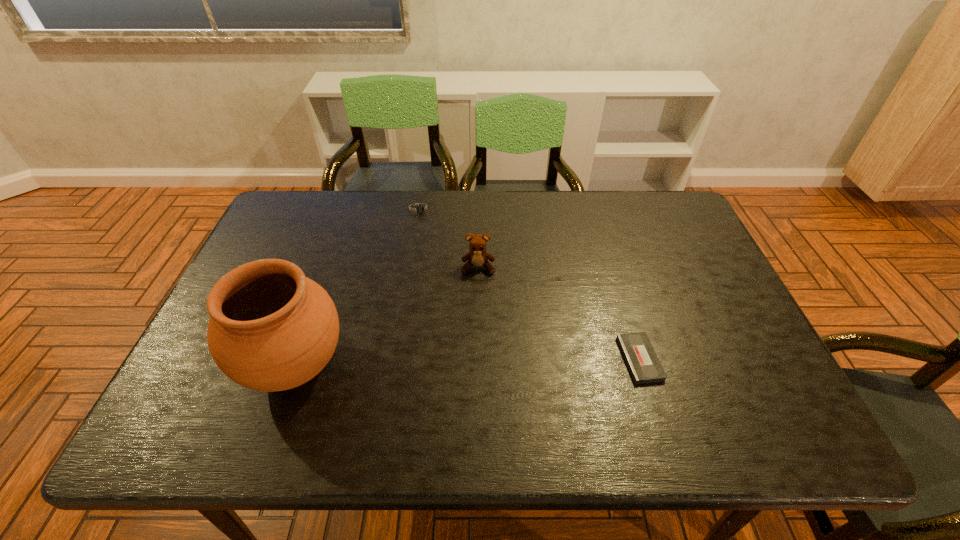
I want to click on vacant area that lies between the second object from right to left and the videotape, so click(559, 313).

You are a GUI agent. You are given a task and a screenshot of the screen. Output one action in this format:
    pyautogui.click(x=<x>, y=<y>)
    Task: Click on the unoccupied position between the shortest object and the second shortest object
    
    Given the screenshot: What is the action you would take?
    pyautogui.click(x=530, y=284)

Find the location of a particular element. Image resolution: width=960 pixels, height=540 pixels. vacant point located between the videotape and the watch is located at coordinates (530, 284).

The width and height of the screenshot is (960, 540). I want to click on free space between the farthest object and the leftmost object, so click(x=358, y=287).

Locate an element on the screen. Image resolution: width=960 pixels, height=540 pixels. free space between the watch and the shortest object is located at coordinates (530, 284).

Find the location of a particular element. The image size is (960, 540). vacant region between the rightmost object and the pottery is located at coordinates point(468,362).

Locate which object ranks third in proximity to the pottery. Please provide its 2D coordinates. Your answer should be formatted as a tuple, i.e. [(x, y)], where the tuple contains the x and y coordinates of a point satisfying the conditions above.

[(641, 359)]

Locate an element on the screen. Image resolution: width=960 pixels, height=540 pixels. object that is the second closest one to the shortest object is located at coordinates (271, 329).

Where is `vacant space that satisfies the following two spatial constraints: 1. on the back side of the pottery; 2. on the left side of the third tallest object`? vacant space that satisfies the following two spatial constraints: 1. on the back side of the pottery; 2. on the left side of the third tallest object is located at coordinates (349, 209).

At what (x,y) coordinates should I click in order to perform the action: click on free location that satisfies the following two spatial constraints: 1. on the front side of the third object from right to left; 2. on the right side of the third nearest object. Please return your answer as a coordinate pair (x, y). The height and width of the screenshot is (540, 960). Looking at the image, I should click on (411, 267).